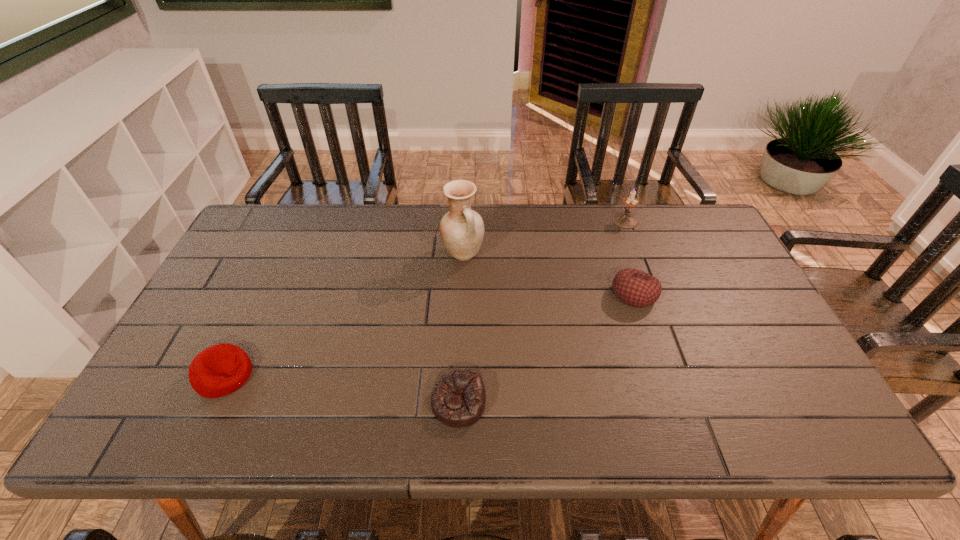
The width and height of the screenshot is (960, 540). Find the location of `the fourth nearest object`. the fourth nearest object is located at coordinates (461, 229).

The width and height of the screenshot is (960, 540). What are the coordinates of `pottery` in the screenshot? It's located at (461, 229).

You are a GUI agent. You are given a task and a screenshot of the screen. Output one action in this format:
    pyautogui.click(x=<x>, y=<y>)
    Task: Click on the second tallest object
    The width and height of the screenshot is (960, 540).
    Given the screenshot: What is the action you would take?
    pyautogui.click(x=625, y=220)

Find the location of a particular element. The height and width of the screenshot is (540, 960). candle holder is located at coordinates (625, 220).

This screenshot has width=960, height=540. Find the location of `the rightmost beanbag`. the rightmost beanbag is located at coordinates (635, 288).

Where is `the farthest beanbag`? the farthest beanbag is located at coordinates (635, 288).

The image size is (960, 540). Identify the location of the leftmost beanbag. (219, 370).

Image resolution: width=960 pixels, height=540 pixels. I want to click on the shortest object, so click(x=458, y=399).

I want to click on the second beanbag from right to left, so click(x=458, y=399).

In order to click on vacant area located 0.160m on the back of the second farthest object in this screenshot , I will do `click(465, 210)`.